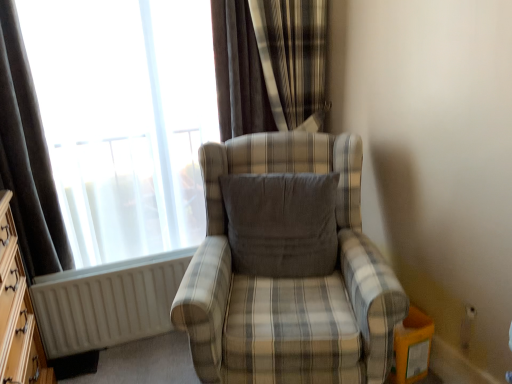
I want to click on vacant area on top of white matte radiator at lower left (from a real-world perspective), so click(121, 269).